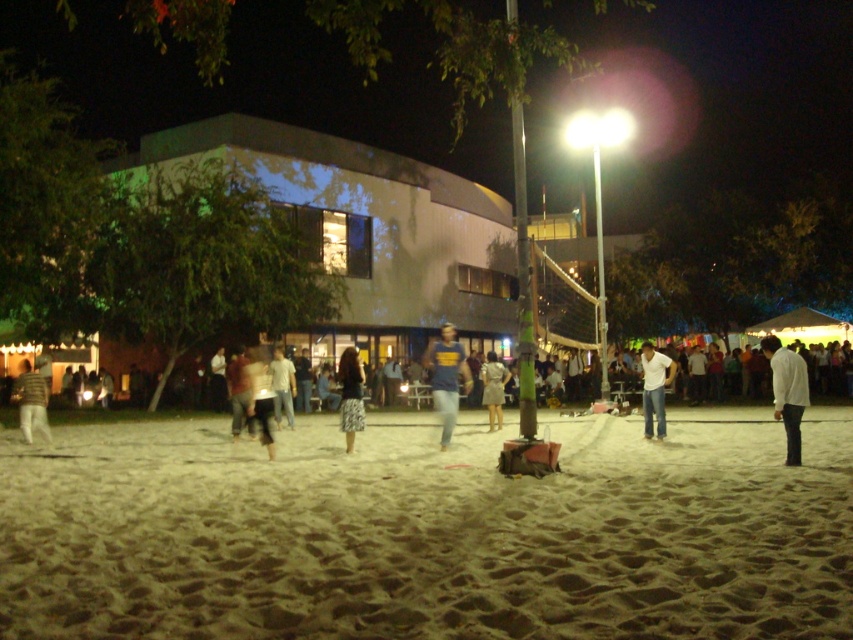
Question: Can you confirm if blue jersey at center is positioned to the left of light gray dress at center?

Choices:
 (A) no
 (B) yes

Answer: (B)

Question: In this image, where is beige sand at center located relative to patterned fabric skirt at center?

Choices:
 (A) left
 (B) right

Answer: (B)

Question: Which point is farther to the camera?

Choices:
 (A) light blue jeans at center
 (B) blue jersey at center
 (C) striped sweater at left
 (D) dark gray jeans at center

Answer: (A)

Question: Can you confirm if blue jersey at center is bigger than light blue jeans at center?

Choices:
 (A) no
 (B) yes

Answer: (B)

Question: Which point appears farthest from the camera in this image?

Choices:
 (A) (355, 385)
 (B) (793, 401)
 (C) (347, 476)

Answer: (A)

Question: Which of the following is the closest to the observer?

Choices:
 (A) patterned fabric skirt at center
 (B) beige sand at center

Answer: (B)